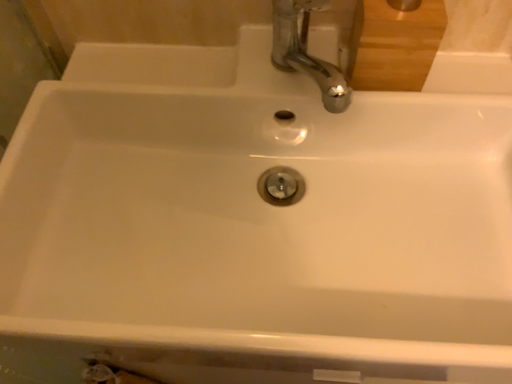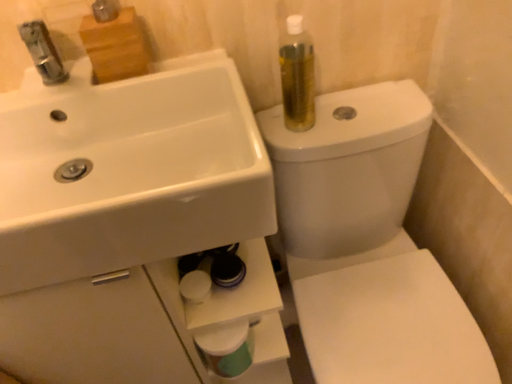
Question: Which way did the camera rotate in the video?

Choices:
 (A) rotated upward
 (B) rotated downward

Answer: (A)